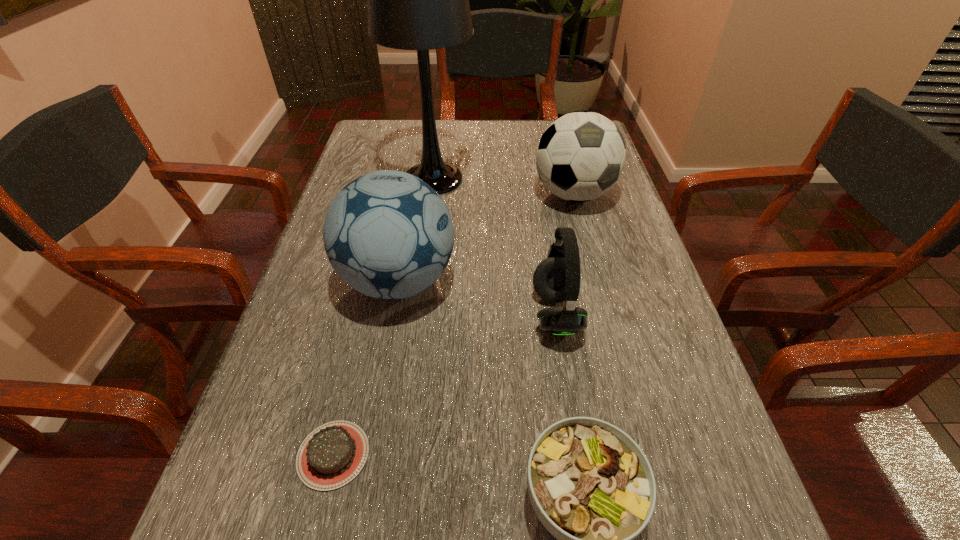
The width and height of the screenshot is (960, 540). Identify the location of vacant region that satisfies the following two spatial constraints: 1. on the main logo of the right soccer ball; 2. on the side with brand of the left soccer ball. (596, 281).

Identify the location of free location that satisfies the following two spatial constraints: 1. on the ear cups of the headset; 2. on the front side of the chocolate cake. (578, 455).